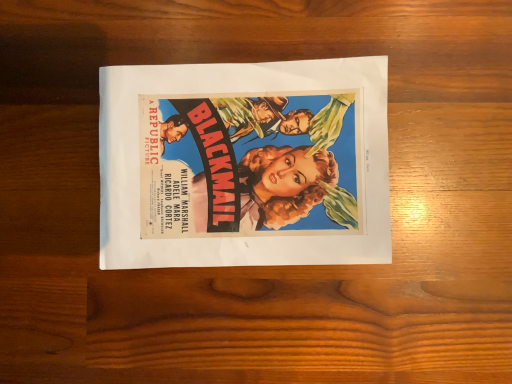
You are a GUI agent. You are given a task and a screenshot of the screen. Output one action in this format:
    pyautogui.click(x=<x>, y=<y>)
    Task: Click on the free spot above matte paper poster at center (from a real-world perspective)
    The width and height of the screenshot is (512, 384).
    Given the screenshot: What is the action you would take?
    pyautogui.click(x=244, y=164)